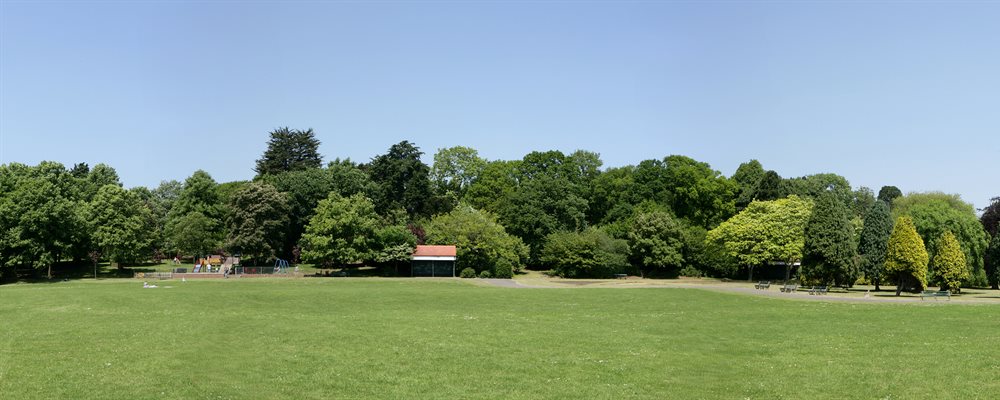
In order to click on benches in this screenshot , I will do `click(765, 286)`, `click(784, 291)`, `click(807, 292)`, `click(945, 294)`.